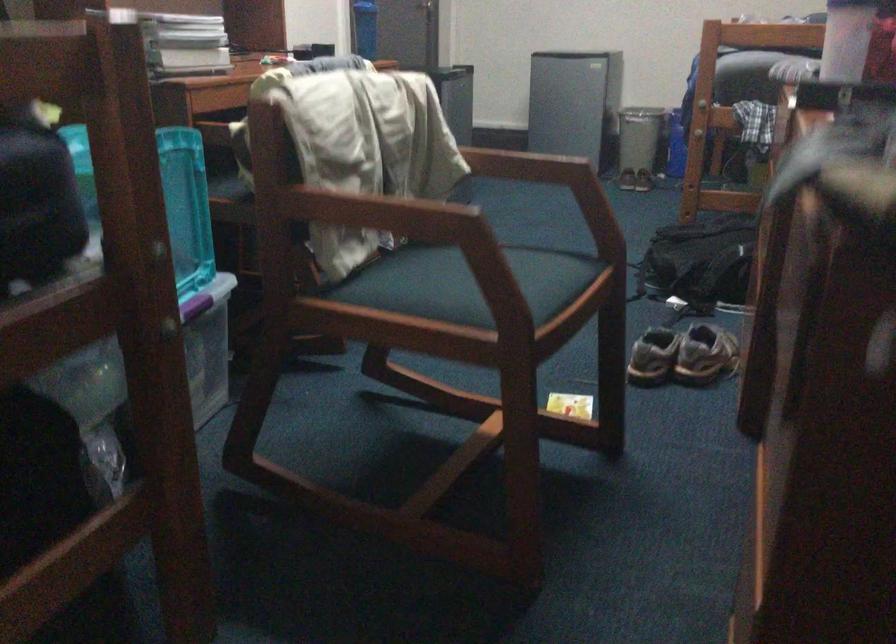
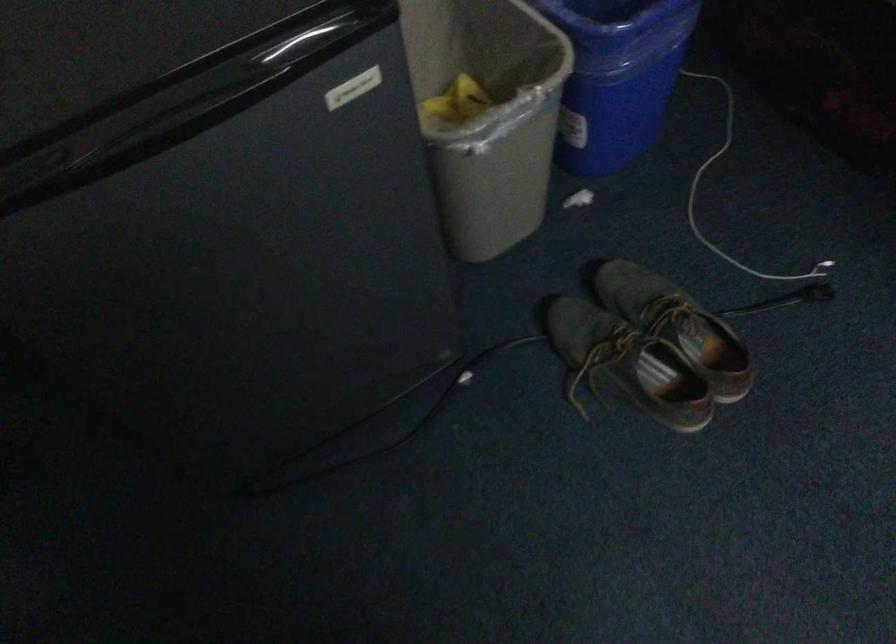
Locate, in the second image, the point that corresponds to pixel 618 79 in the first image.

(487, 115)